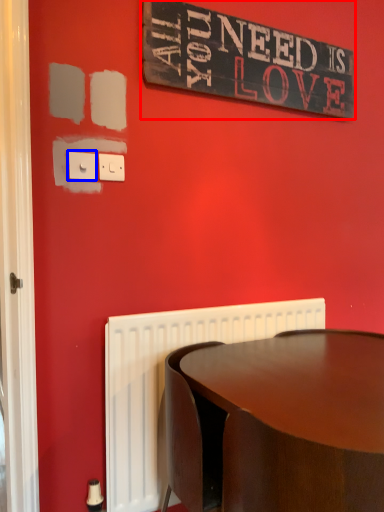
Question: Which of the following is the closest to the observer, bulletin board (highlighted by a red box) or electric outlet (highlighted by a blue box)?

Choices:
 (A) bulletin board
 (B) electric outlet

Answer: (B)